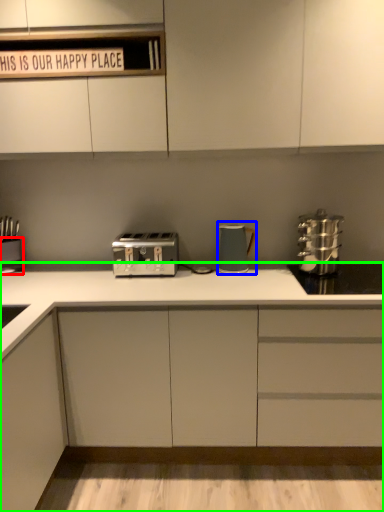
Question: Estimate the real-world distances between objects in this image. Which object is closer to appliance (highlighted by a red box), kitchen appliance (highlighted by a blue box) or cabinetry (highlighted by a green box)?

Choices:
 (A) kitchen appliance
 (B) cabinetry

Answer: (B)